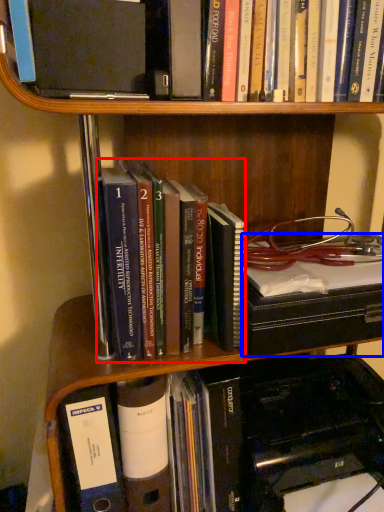
Question: Which object appears farthest to the camera in this image, book (highlighted by a red box) or book (highlighted by a blue box)?

Choices:
 (A) book
 (B) book

Answer: (B)